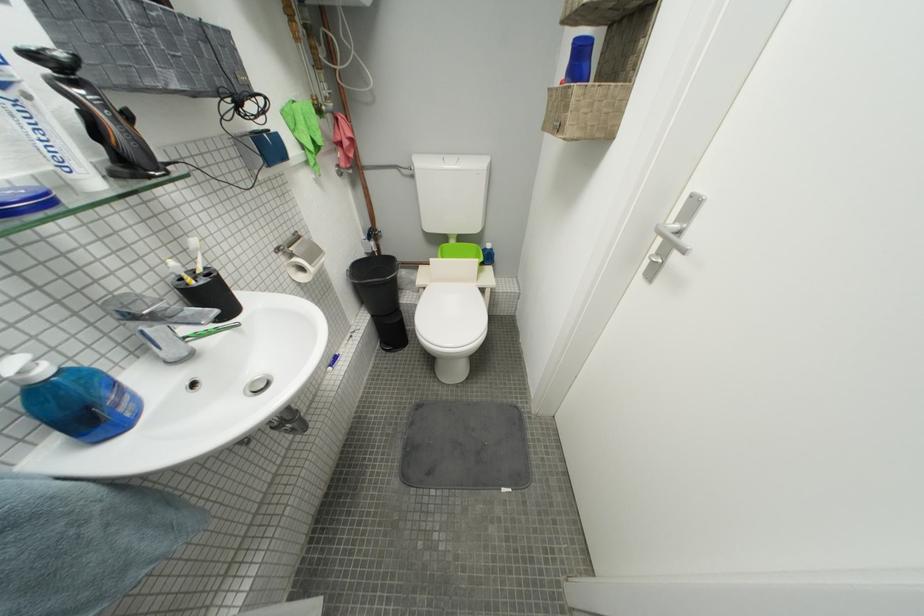
Locate an element on the screen. toothpaste tube is located at coordinates (45, 132).